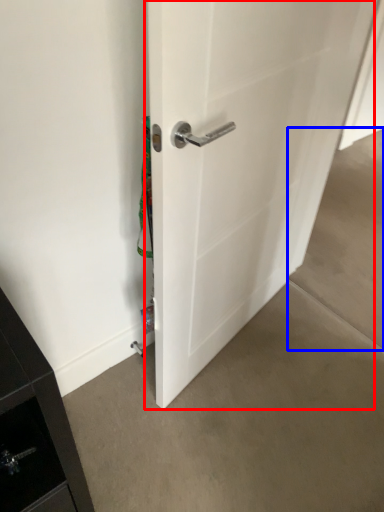
Question: Which point is further to the camera, door (highlighted by a red box) or concrete (highlighted by a blue box)?

Choices:
 (A) door
 (B) concrete

Answer: (B)